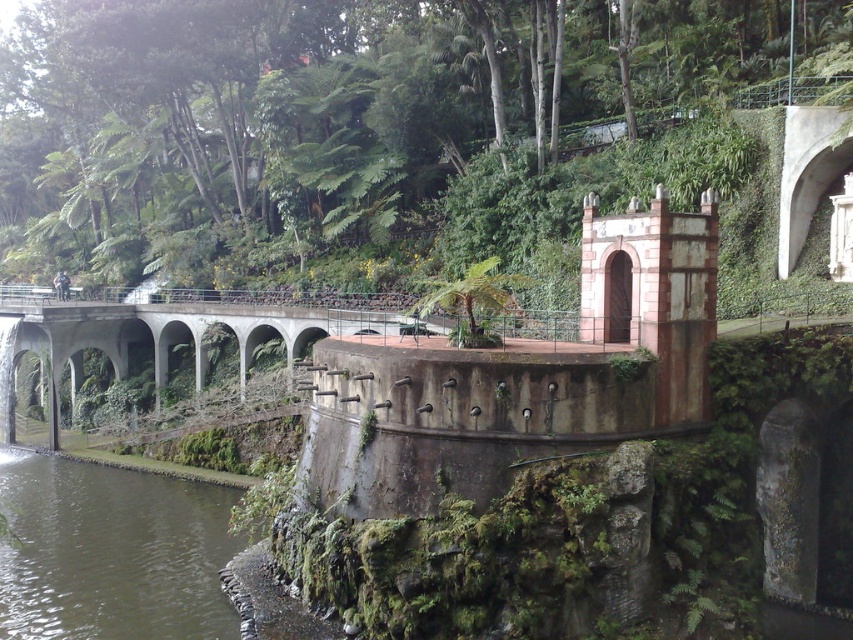
Question: Is green mossy river at lower left smaller than concrete bridge at center?

Choices:
 (A) yes
 (B) no

Answer: (A)

Question: Which point is closer to the camera taking this photo?

Choices:
 (A) (67, 468)
 (B) (602, 33)

Answer: (A)

Question: Which point is closer to the camera?

Choices:
 (A) green leafy vegetation at upper center
 (B) concrete bridge at center
 (C) green mossy river at lower left

Answer: (C)

Question: Can you confirm if green mossy river at lower left is smaller than concrete bridge at center?

Choices:
 (A) no
 (B) yes

Answer: (B)

Question: Estimate the real-world distances between objects in this image. Which object is closer to the green mossy river at lower left?

Choices:
 (A) concrete bridge at center
 (B) green leafy vegetation at upper center

Answer: (A)

Question: Can you confirm if green leafy vegetation at upper center is positioned to the right of concrete bridge at center?

Choices:
 (A) no
 (B) yes

Answer: (A)